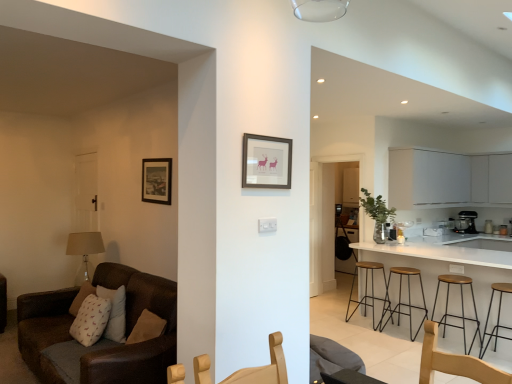
Question: Considering the relative positions of wooden seat at right, placed as the third stool when sorted from front to back, and white matte cabinet at upper right in the image provided, is wooden seat at right, placed as the third stool when sorted from front to back, to the right of white matte cabinet at upper right from the viewer's perspective?

Choices:
 (A) yes
 (B) no

Answer: (B)

Question: From the image's perspective, is wooden seat at right, placed as the third stool when sorted from front to back, on top of white matte cabinet at upper right?

Choices:
 (A) no
 (B) yes

Answer: (A)

Question: Is white matte cabinet at upper right inside wooden seat at right, the second stool viewed from the back?

Choices:
 (A) yes
 (B) no

Answer: (B)

Question: Considering the relative positions of wooden seat at right, placed as the third stool when sorted from front to back, and white matte cabinet at upper right in the image provided, is wooden seat at right, placed as the third stool when sorted from front to back, to the left of white matte cabinet at upper right from the viewer's perspective?

Choices:
 (A) yes
 (B) no

Answer: (A)

Question: Is wooden seat at right, placed as the third stool when sorted from front to back, wider than white matte cabinet at upper right?

Choices:
 (A) yes
 (B) no

Answer: (B)

Question: Is matte black picture frame at upper center, the 2th picture frame from the right, bigger or smaller than wooden stool at lower right, placed as the fourth stool when sorted from back to front?

Choices:
 (A) big
 (B) small

Answer: (B)

Question: From the image's perspective, is matte black picture frame at upper center, arranged as the first picture frame when viewed from the left, positioned above or below wooden stool at lower right, the 1th stool in the front-to-back sequence?

Choices:
 (A) above
 (B) below

Answer: (A)

Question: Relative to wooden stool at lower right, placed as the fourth stool when sorted from back to front, is matte black picture frame at upper center, which is the 1th picture frame in back-to-front order, in front or behind?

Choices:
 (A) front
 (B) behind

Answer: (B)

Question: Considering the positions of matte black picture frame at upper center, the second picture frame from the front, and wooden stool at lower right, the 1th stool in the front-to-back sequence, in the image, is matte black picture frame at upper center, the second picture frame from the front, wider or thinner than wooden stool at lower right, the 1th stool in the front-to-back sequence,?

Choices:
 (A) wide
 (B) thin

Answer: (B)

Question: From the image's perspective, is brown leather couch at left positioned above or below metallic silver blender at right?

Choices:
 (A) below
 (B) above

Answer: (A)

Question: Is point (155, 286) positioned closer to the camera than point (468, 233)?

Choices:
 (A) farther
 (B) closer

Answer: (B)

Question: Considering the positions of brown leather couch at left and metallic silver blender at right in the image, is brown leather couch at left wider or thinner than metallic silver blender at right?

Choices:
 (A) thin
 (B) wide

Answer: (B)

Question: Considering the positions of brown leather couch at left and metallic silver blender at right in the image, is brown leather couch at left taller or shorter than metallic silver blender at right?

Choices:
 (A) short
 (B) tall

Answer: (B)

Question: Is wooden stool at lower right, placed as the fourth stool when sorted from back to front, in front of or behind brown leather couch at left in the image?

Choices:
 (A) behind
 (B) front

Answer: (A)

Question: From the image's perspective, is wooden stool at lower right, placed as the fourth stool when sorted from back to front, above or below brown leather couch at left?

Choices:
 (A) below
 (B) above

Answer: (A)